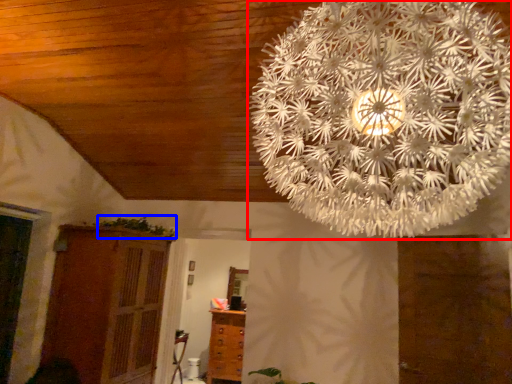
Question: Among these objects, which one is farthest to the camera, lamp (highlighted by a red box) or plant (highlighted by a blue box)?

Choices:
 (A) lamp
 (B) plant

Answer: (B)